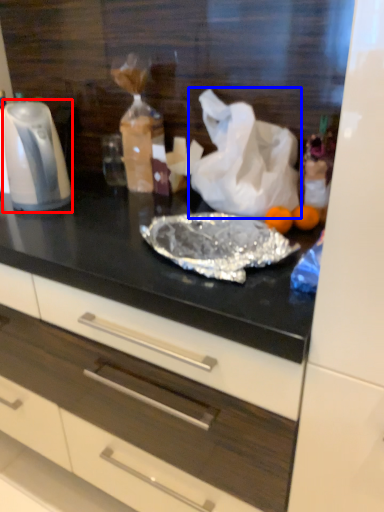
Question: Among these objects, which one is farthest to the camera, kitchen appliance (highlighted by a red box) or plastic bag (highlighted by a blue box)?

Choices:
 (A) kitchen appliance
 (B) plastic bag

Answer: (A)